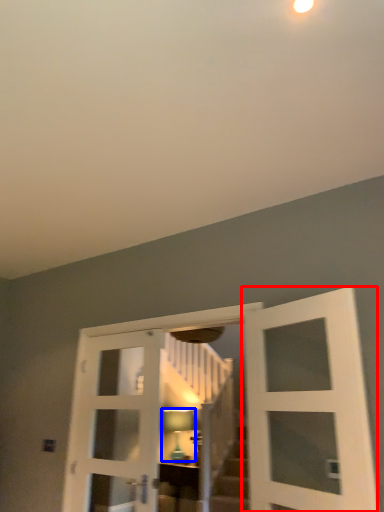
Question: Which of the following is the closest to the observer, door (highlighted by a red box) or light fixture (highlighted by a blue box)?

Choices:
 (A) door
 (B) light fixture

Answer: (A)